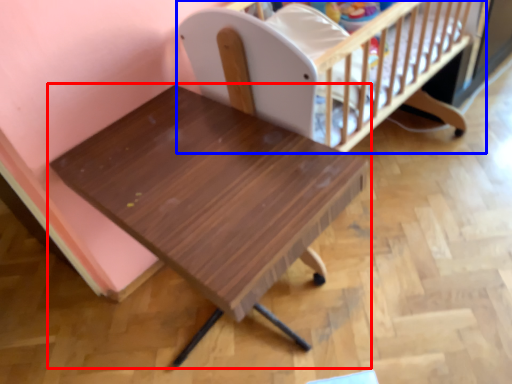
Question: Which object appears farthest to the camera in this image, table (highlighted by a red box) or infant bed (highlighted by a blue box)?

Choices:
 (A) table
 (B) infant bed

Answer: (B)